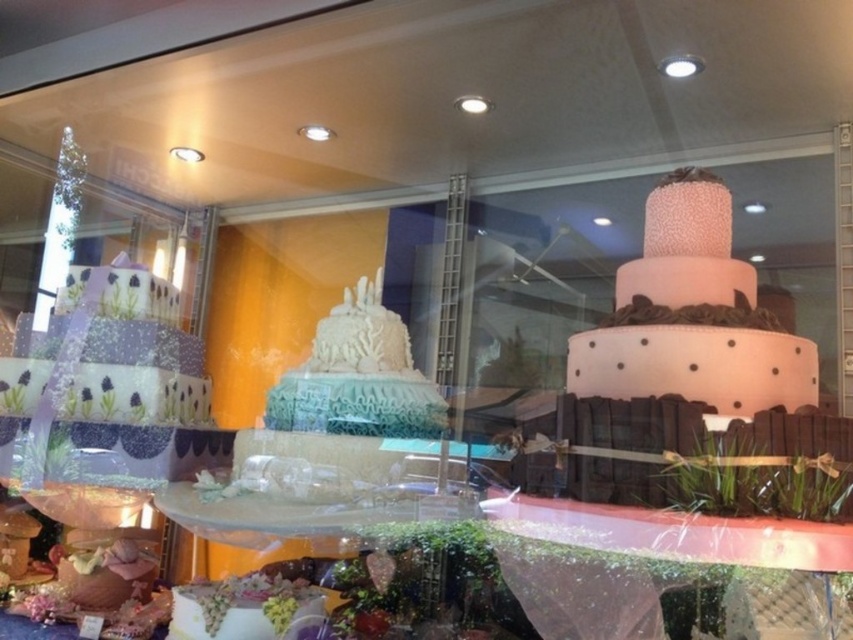
Question: Which of the following is the closest to the observer?

Choices:
 (A) (154, 378)
 (B) (355, 403)
 (C) (654, 205)

Answer: (C)

Question: Does pink textured cake at center have a greater width compared to white textured cake at center?

Choices:
 (A) yes
 (B) no

Answer: (B)

Question: Which object is positioned closest to the white textured cake at lower center?

Choices:
 (A) lavender fondant cake at left
 (B) white textured cake at center
 (C) pink textured cake at center

Answer: (B)

Question: Is lavender fondant cake at left further to camera compared to white textured cake at lower center?

Choices:
 (A) yes
 (B) no

Answer: (A)

Question: Which point is closer to the camera taking this photo?

Choices:
 (A) (252, 636)
 (B) (6, 428)
 (C) (399, 410)

Answer: (A)

Question: Is lavender fondant cake at left to the left of white textured cake at lower center from the viewer's perspective?

Choices:
 (A) yes
 (B) no

Answer: (A)